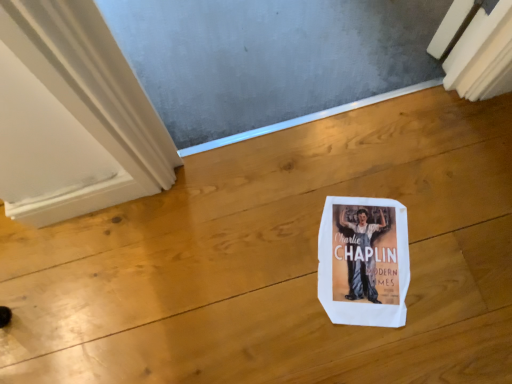
I want to click on blank area beneath white paper bag at center (from a real-world perspective), so click(366, 253).